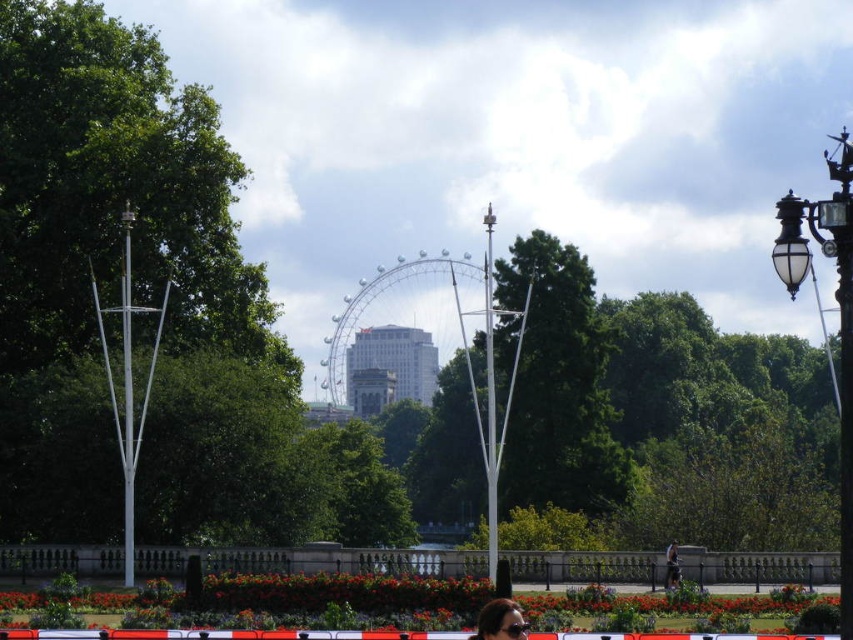
You are standing at the center of the pathway and want to reach both the point at coordinates point (282, 572) and point (497, 620). Which point should you walk towards first to reach them in the shortest path?

You should walk towards point (282, 572) first because it is closer to you than point (497, 620), which is further away.

You are standing at the entrance of the park and want to reach the flower bed with red flowers. There is a concrete barrier at lower center in your way. Based on its position, can you walk around it to the left or right side?

The concrete barrier at lower center is positioned at coordinates point (x=312, y=561). Since the barrier is at the lower center, you can walk around it either to the left or right side to reach the flower bed with red flowers.